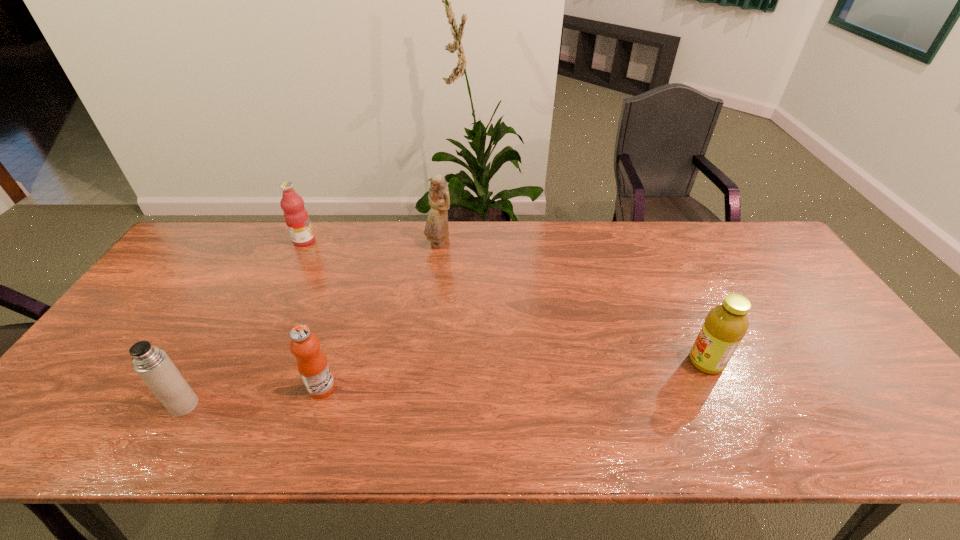
Where is `figurine`? The image size is (960, 540). figurine is located at coordinates (436, 229).

Where is `the fourth object from left to right`? The image size is (960, 540). the fourth object from left to right is located at coordinates (436, 229).

Where is `the leftmost fruit juice`? This screenshot has height=540, width=960. the leftmost fruit juice is located at coordinates (296, 217).

Locate an element on the screen. This screenshot has width=960, height=540. the second object from left to right is located at coordinates (296, 217).

Identify the location of the rightmost object. This screenshot has height=540, width=960. (725, 325).

Locate an element on the screen. The image size is (960, 540). thermos bottle is located at coordinates (153, 365).

In order to click on the second fruit juice from right to left in this screenshot , I will do `click(312, 364)`.

Identify the location of vacant region located 0.130m on the front-facing side of the tallest object. (435, 279).

Where is `free space located on the label of the farthest fruit juice`? free space located on the label of the farthest fruit juice is located at coordinates (393, 241).

Where is `vacant area situated on the front label of the rightmost fruit juice`? The width and height of the screenshot is (960, 540). vacant area situated on the front label of the rightmost fruit juice is located at coordinates (605, 362).